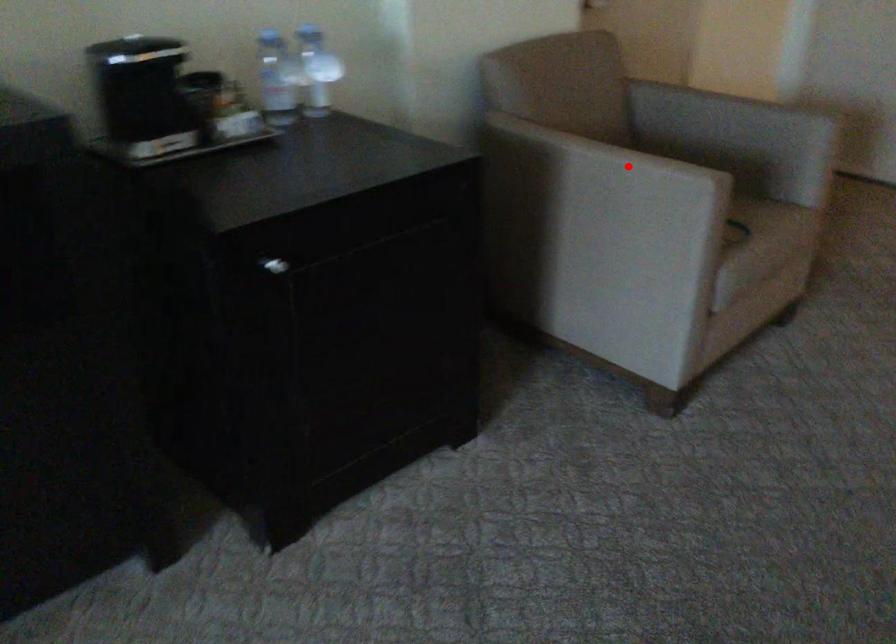
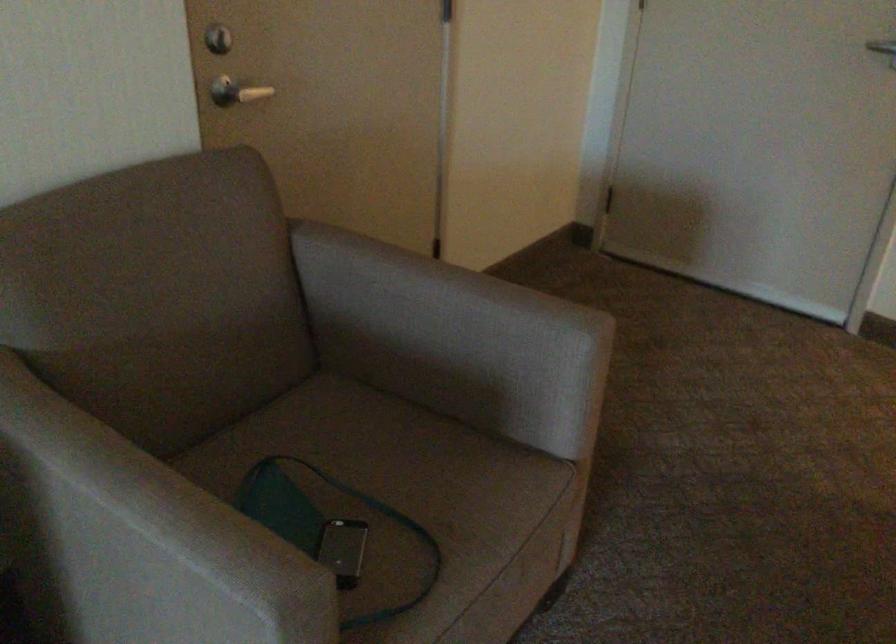
In the second image, find the point that corresponds to the highlighted location in the first image.

(150, 538)